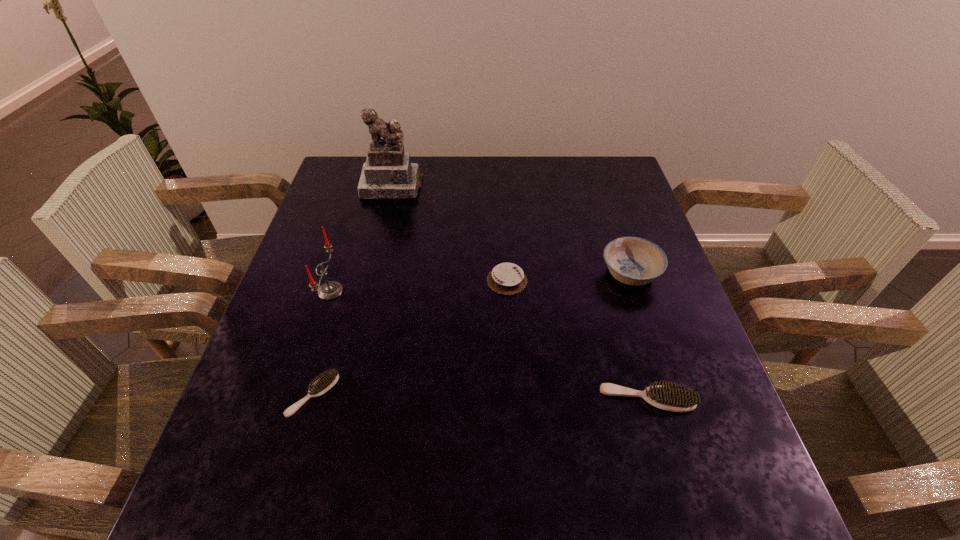
If equal spacing is the goal by inserting an additional scrubbing_brush among them, please point out a vacant space for this new scrubbing_brush. Please provide its 2D coordinates. Your answer should be formatted as a tuple, i.e. [(x, y)], where the tuple contains the x and y coordinates of a point satisfying the conditions above.

[(480, 397)]